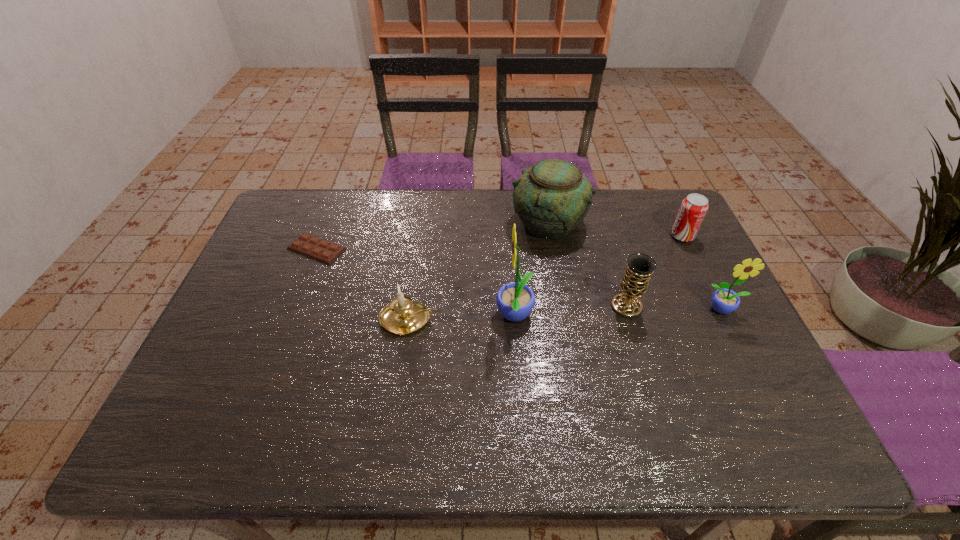
Locate an element on the screen. the left sunflower is located at coordinates (515, 301).

The width and height of the screenshot is (960, 540). I want to click on the taller sunflower, so click(515, 301).

I want to click on the shorter sunflower, so click(x=724, y=301).

Where is `the shortest object`? This screenshot has height=540, width=960. the shortest object is located at coordinates (310, 246).

Identify the location of the leftmost object. This screenshot has width=960, height=540. (310, 246).

You are a GUI agent. You are given a task and a screenshot of the screen. Output one action in this format:
    pyautogui.click(x=<x>, y=<y>)
    Task: Click on the pottery
    Image resolution: width=960 pixels, height=540 pixels.
    Given the screenshot: What is the action you would take?
    pyautogui.click(x=552, y=198)

The height and width of the screenshot is (540, 960). Identify the location of soda can. (693, 209).

This screenshot has height=540, width=960. Identify the location of candle holder. (402, 316).

I want to click on the third object from right to left, so click(634, 284).

The width and height of the screenshot is (960, 540). I want to click on vacant space positioned 0.280m on the front-facing side of the left sunflower, so click(x=393, y=316).